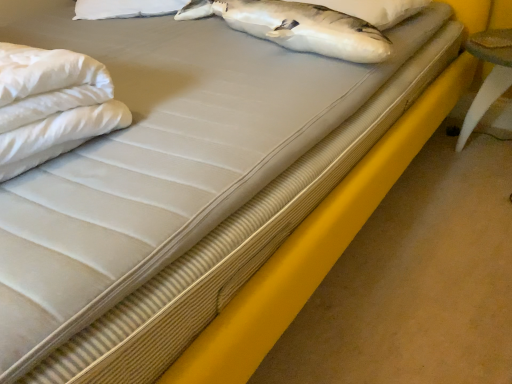
Question: Considering the relative positions of white soft pillow at upper center and white soft fabric at left in the image provided, is white soft pillow at upper center to the right of white soft fabric at left from the viewer's perspective?

Choices:
 (A) yes
 (B) no

Answer: (A)

Question: Is white soft pillow at upper center at the left side of white soft fabric at left?

Choices:
 (A) no
 (B) yes

Answer: (A)

Question: Is white soft pillow at upper center closer to camera compared to white soft fabric at left?

Choices:
 (A) no
 (B) yes

Answer: (A)

Question: Is white soft pillow at upper center outside of white soft fabric at left?

Choices:
 (A) yes
 (B) no

Answer: (A)

Question: From a real-world perspective, is white soft pillow at upper center located higher than white soft fabric at left?

Choices:
 (A) yes
 (B) no

Answer: (B)

Question: Is white soft pillow at upper center oriented towards white soft fabric at left?

Choices:
 (A) no
 (B) yes

Answer: (B)

Question: Does white soft fabric at left have a lesser height compared to white soft pillow at upper center?

Choices:
 (A) yes
 (B) no

Answer: (B)

Question: Is white soft fabric at left bigger than white soft pillow at upper center?

Choices:
 (A) no
 (B) yes

Answer: (B)

Question: Can you confirm if white soft fabric at left is thinner than white soft pillow at upper center?

Choices:
 (A) no
 (B) yes

Answer: (B)

Question: Is the depth of white soft fabric at left greater than that of white soft pillow at upper center?

Choices:
 (A) no
 (B) yes

Answer: (A)

Question: Is white soft fabric at left oriented away from white soft pillow at upper center?

Choices:
 (A) no
 (B) yes

Answer: (B)

Question: Is white soft fabric at left in contact with white soft pillow at upper center?

Choices:
 (A) no
 (B) yes

Answer: (A)

Question: Is point (389, 8) positioned closer to the camera than point (22, 170)?

Choices:
 (A) farther
 (B) closer

Answer: (A)